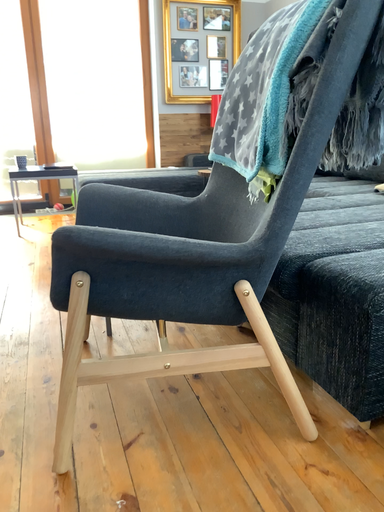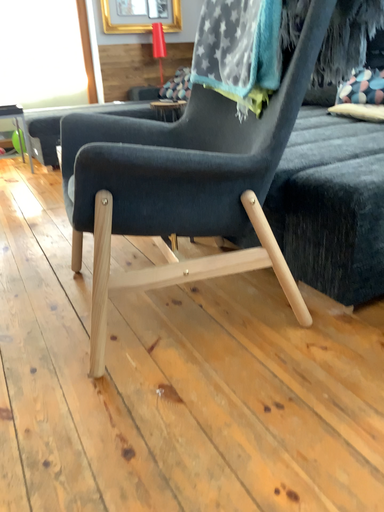
Question: How did the camera likely rotate when shooting the video?

Choices:
 (A) rotated upward
 (B) rotated downward

Answer: (B)